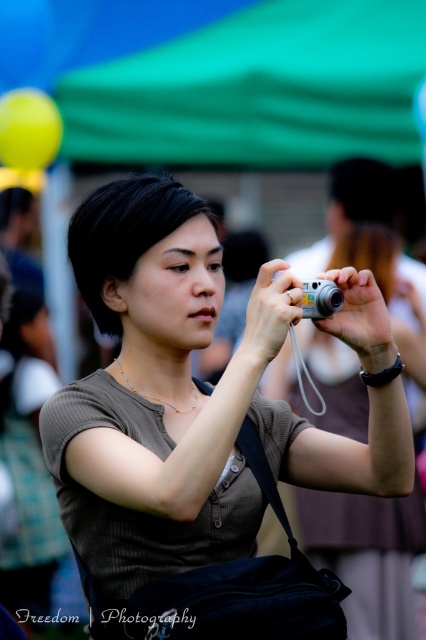
Question: Can you confirm if matte brown shirt at center is positioned to the left of silver metallic camera at center?

Choices:
 (A) no
 (B) yes

Answer: (B)

Question: Considering the real-world distances, which object is farthest from the green fabric canopy at upper center?

Choices:
 (A) matte brown shirt at center
 (B) silver metallic camera at center

Answer: (B)

Question: From the image, what is the correct spatial relationship of matte brown shirt at center in relation to silver metallic camera at center?

Choices:
 (A) below
 (B) above

Answer: (A)

Question: Does matte brown shirt at center come behind green fabric canopy at upper center?

Choices:
 (A) no
 (B) yes

Answer: (A)

Question: Based on their relative distances, which object is farther from the silver metallic camera at center?

Choices:
 (A) green fabric canopy at upper center
 (B) matte brown shirt at center

Answer: (A)

Question: Which point is closer to the camera?

Choices:
 (A) matte brown shirt at center
 (B) silver metallic camera at center
 (C) green fabric canopy at upper center

Answer: (A)